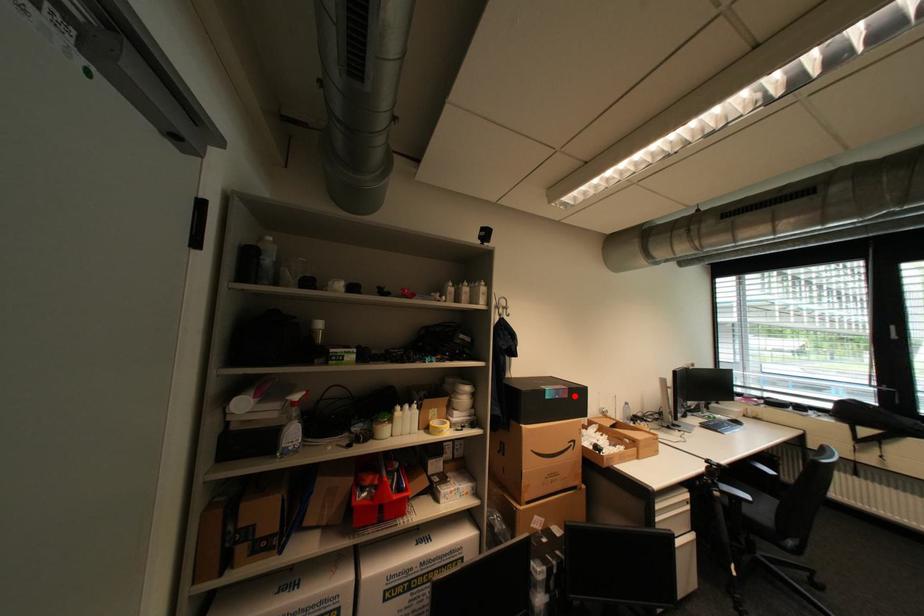
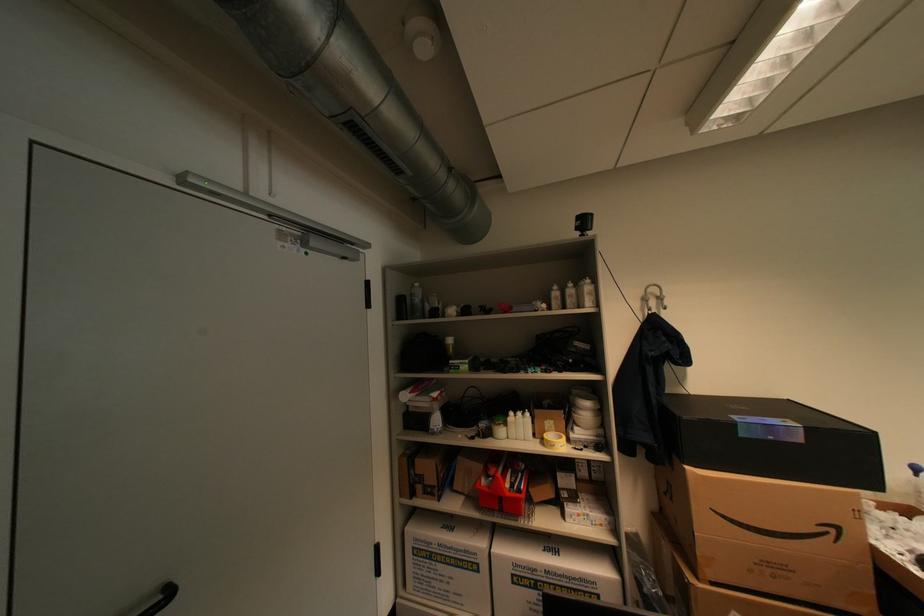
Question: I am providing you with two images of the same scene from different viewpoints. Given a red point in image1, look at the same physical point in image2. Is it:

Choices:
 (A) Closer to the viewpoint
 (B) Farther from the viewpoint

Answer: (A)